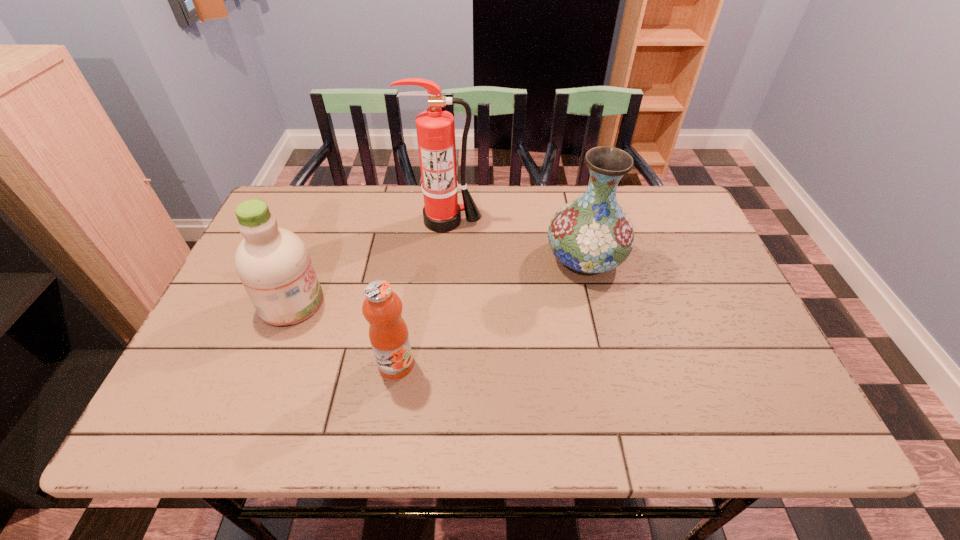
Choose which object is the second nearest neighbor to the tallest object. Please provide its 2D coordinates. Your answer should be formatted as a tuple, i.e. [(x, y)], where the tuple contains the x and y coordinates of a point satisfying the conditions above.

[(273, 264)]

The image size is (960, 540). I want to click on vacant space that satisfies the following two spatial constraints: 1. at the nozzle of the tallest object; 2. on the right side of the rightmost object, so pos(443,259).

Identify the location of free space that satisfies the following two spatial constraints: 1. on the front side of the vase; 2. on the front label of the cleansing agent. (596, 303).